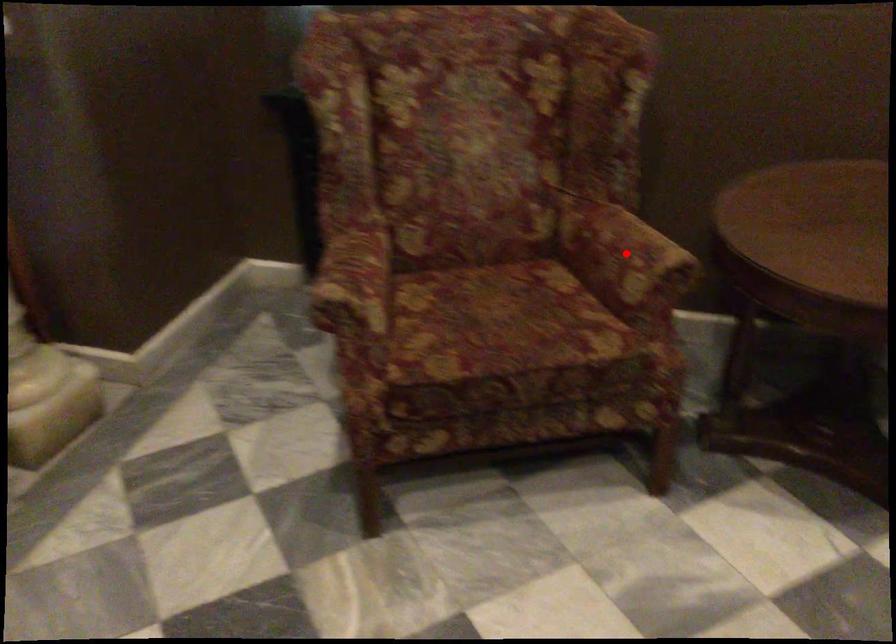
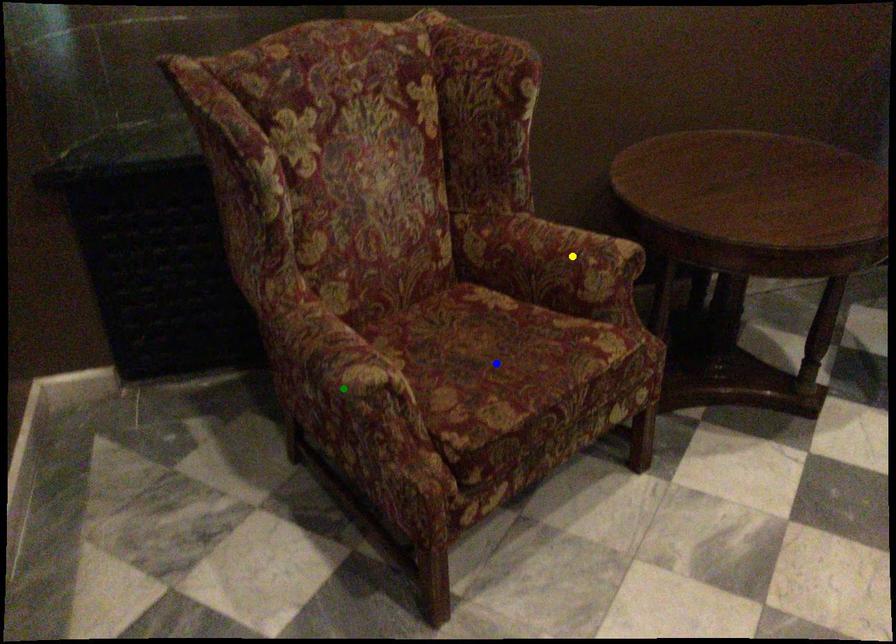
Question: I am providing you with two images of the same scene from different viewpoints. A red point is marked on the first image. You are given multiple points on the second image. Which spot in image 2 lines up with the point in image 1?

Choices:
 (A) yellow point
 (B) blue point
 (C) green point

Answer: (A)